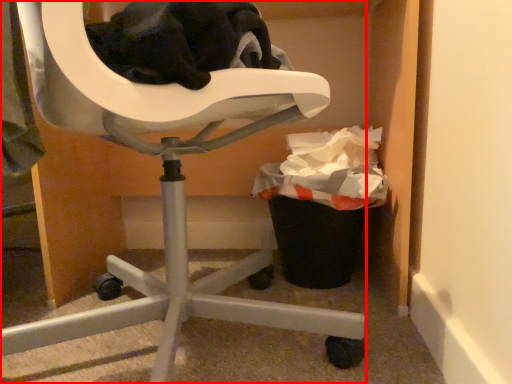
Question: Where is chair (annotated by the red box) located in relation to recycling bin in the image?

Choices:
 (A) left
 (B) right

Answer: (A)